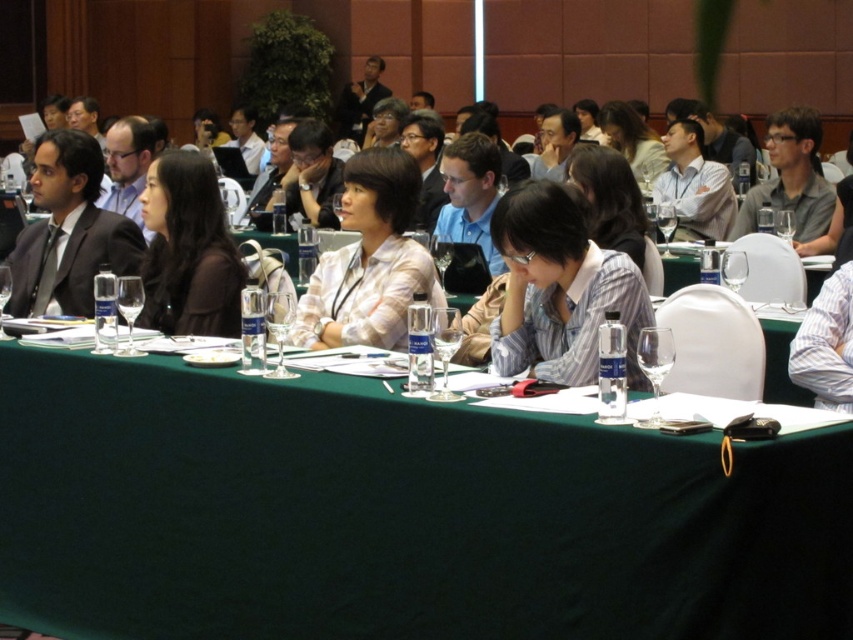
Question: Which of the following is the farthest from the observer?

Choices:
 (A) white shirt at center
 (B) matte gray shirt at upper right
 (C) matte black shirt at center
 (D) white textured shirt at center

Answer: (A)

Question: Which is farther from the matte gray shirt at upper right?

Choices:
 (A) white textured shirt at center
 (B) matte blue shirt at center
 (C) matte black shirt at center
 (D) white shirt at center

Answer: (C)

Question: Which object is positioned farthest from the white textured shirt at center?

Choices:
 (A) matte black shirt at center
 (B) blue shirt at center
 (C) dark gray suit at left

Answer: (C)

Question: Is dark gray suit at left bigger than white shirt at center?

Choices:
 (A) yes
 (B) no

Answer: (B)

Question: Does white textured shirt at center have a larger size compared to matte black shirt at center?

Choices:
 (A) no
 (B) yes

Answer: (B)

Question: Does matte gray shirt at upper right appear over blue shirt at center?

Choices:
 (A) yes
 (B) no

Answer: (A)